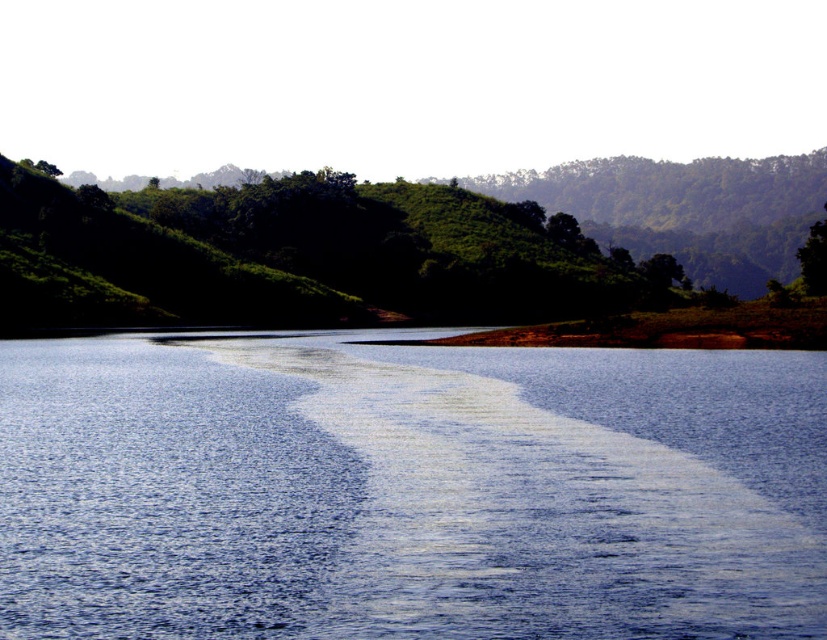
Question: Which of the following is the farthest from the observer?

Choices:
 (A) 676,262
 (B) 692,387
 (C) 462,182

Answer: (C)

Question: Can you confirm if blue smooth water at center is positioned to the left of green leafy tree at upper right?

Choices:
 (A) yes
 (B) no

Answer: (A)

Question: Can you confirm if blue smooth water at center is smaller than green leafy hillside at upper center?

Choices:
 (A) no
 (B) yes

Answer: (B)

Question: Can you confirm if blue smooth water at center is positioned above green leafy hillside at upper center?

Choices:
 (A) yes
 (B) no

Answer: (B)

Question: Which object appears farthest from the camera in this image?

Choices:
 (A) blue smooth water at center
 (B) green leafy tree at upper right
 (C) green leafy hillside at upper center

Answer: (C)

Question: Which point is farther to the camera?

Choices:
 (A) (655, 273)
 (B) (668, 566)

Answer: (A)